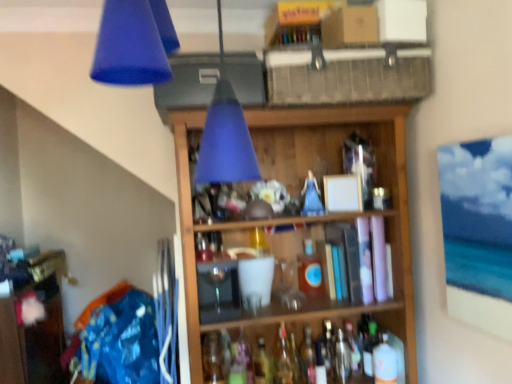
Question: Is translucent glass bottle at center, which is the 1th bottle in left-to-right order, oriented towards matte blue cone at upper center?

Choices:
 (A) yes
 (B) no

Answer: (B)

Question: Does translucent glass bottle at center, placed as the 6th bottle when sorted from right to left, have a lesser width compared to matte blue cone at upper center?

Choices:
 (A) yes
 (B) no

Answer: (A)

Question: Is translucent glass bottle at center, which is the 1th bottle in left-to-right order, turned away from matte blue cone at upper center?

Choices:
 (A) no
 (B) yes

Answer: (A)

Question: Can you confirm if translucent glass bottle at center, which is the 1th bottle in left-to-right order, is taller than matte blue cone at upper center?

Choices:
 (A) yes
 (B) no

Answer: (B)

Question: Is the position of translucent glass bottle at center, placed as the 6th bottle when sorted from right to left, less distant than that of matte blue cone at upper center?

Choices:
 (A) yes
 (B) no

Answer: (B)

Question: Is matte blue cone at upper center surrounded by translucent glass bottle at center, placed as the 6th bottle when sorted from right to left?

Choices:
 (A) no
 (B) yes

Answer: (A)

Question: Is translucent glass bottle at center, which is counted as the fourth bottle, starting from the left, bigger than translucent glass wine bottle at center, which is the second wine bottle in left-to-right order?

Choices:
 (A) no
 (B) yes

Answer: (A)

Question: Is the depth of translucent glass bottle at center, the third bottle viewed from the right, less than that of translucent glass wine bottle at center, marked as the third wine bottle in a right-to-left arrangement?

Choices:
 (A) no
 (B) yes

Answer: (B)

Question: Would you say translucent glass bottle at center, the third bottle viewed from the right, is outside translucent glass wine bottle at center, which is the second wine bottle in left-to-right order?

Choices:
 (A) no
 (B) yes

Answer: (B)

Question: Is translucent glass bottle at center, which is counted as the fourth bottle, starting from the left, aimed at translucent glass wine bottle at center, marked as the third wine bottle in a right-to-left arrangement?

Choices:
 (A) no
 (B) yes

Answer: (A)

Question: From the image's perspective, is translucent glass bottle at center, which is counted as the fourth bottle, starting from the left, below translucent glass wine bottle at center, which is the second wine bottle in left-to-right order?

Choices:
 (A) no
 (B) yes

Answer: (A)

Question: From a real-world perspective, is translucent glass bottle at center, which is counted as the fourth bottle, starting from the left, below translucent glass wine bottle at center, marked as the third wine bottle in a right-to-left arrangement?

Choices:
 (A) no
 (B) yes

Answer: (A)

Question: From a real-world perspective, is wooden shelf at center physically below translucent glass wine bottle at center, which appears as the 4th wine bottle when viewed from the right?

Choices:
 (A) yes
 (B) no

Answer: (B)